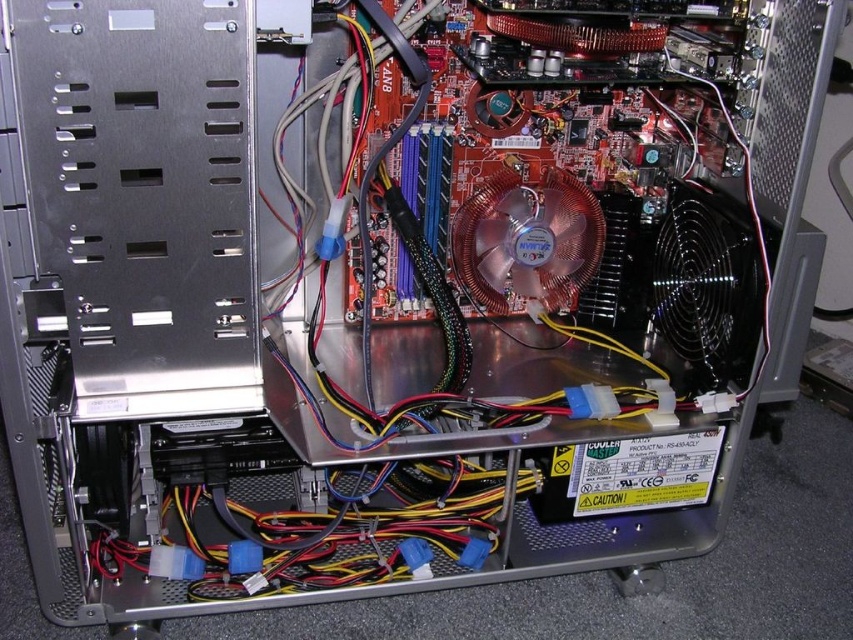
Between black metallic fan at right and copper/brass fan at center, which one is positioned lower?

black metallic fan at right is below.

Is black metallic fan at right positioned in front of copper/brass fan at center?

Yes, black metallic fan at right is in front of copper/brass fan at center.

Image resolution: width=853 pixels, height=640 pixels. I want to click on black metallic fan at right, so click(x=708, y=282).